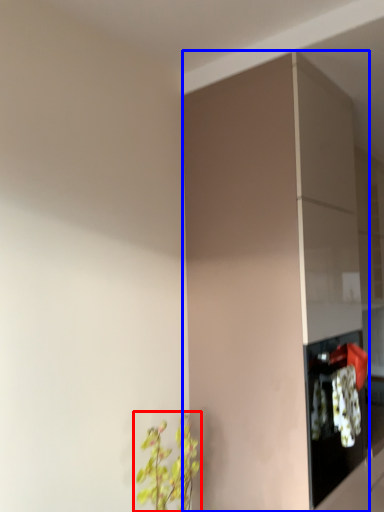
Question: Among these objects, which one is farthest to the camera, houseplant (highlighted by a red box) or cabinetry (highlighted by a blue box)?

Choices:
 (A) houseplant
 (B) cabinetry

Answer: (B)